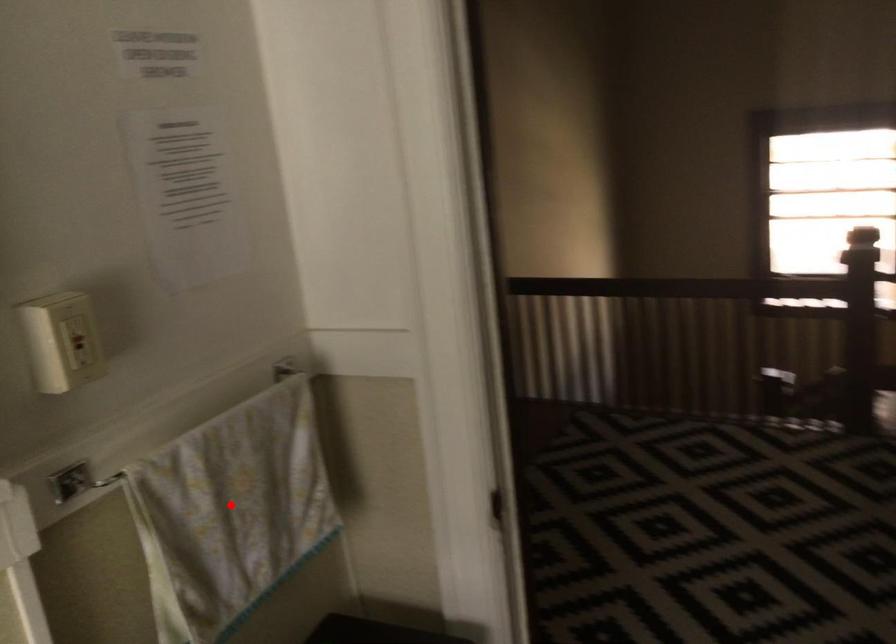
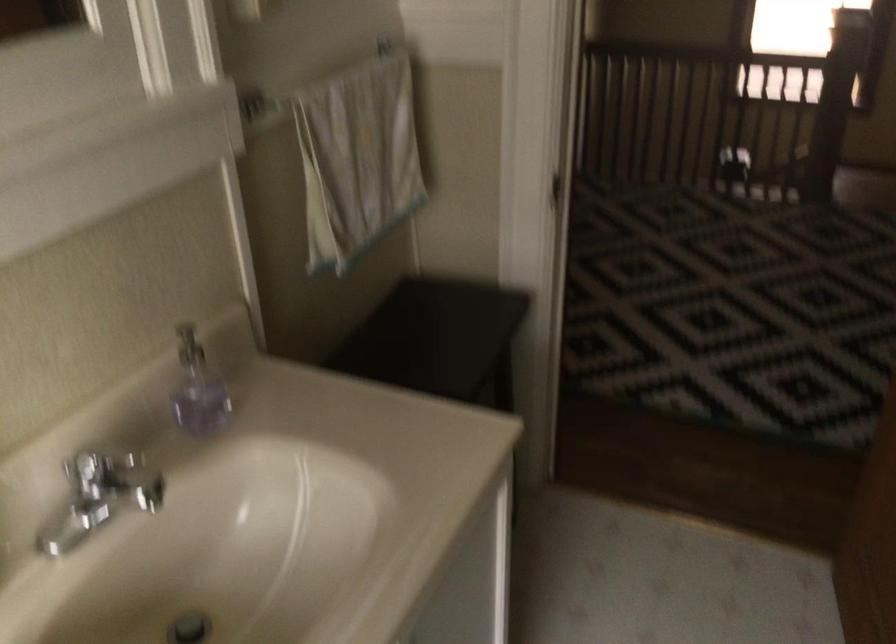
Question: I am providing you with two images of the same scene from different viewpoints. Image1 has a red point marked. In image2, the corresponding 3D location appears at what relative position? Reply with the corresponding letter.

Choices:
 (A) Closer
 (B) Farther

Answer: (B)